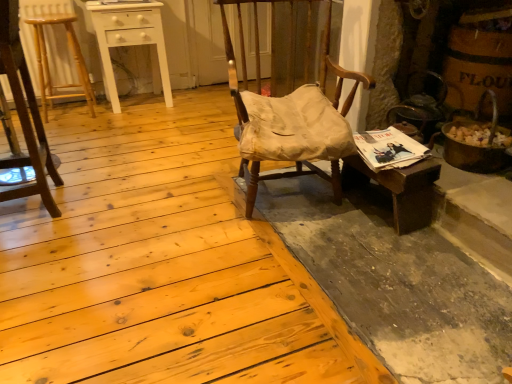
Identify the location of free space between wooden chair with worn fabric cushion at center, the first chair in the right-to-left sequence, and light brown wood bar stool at left. (147, 149).